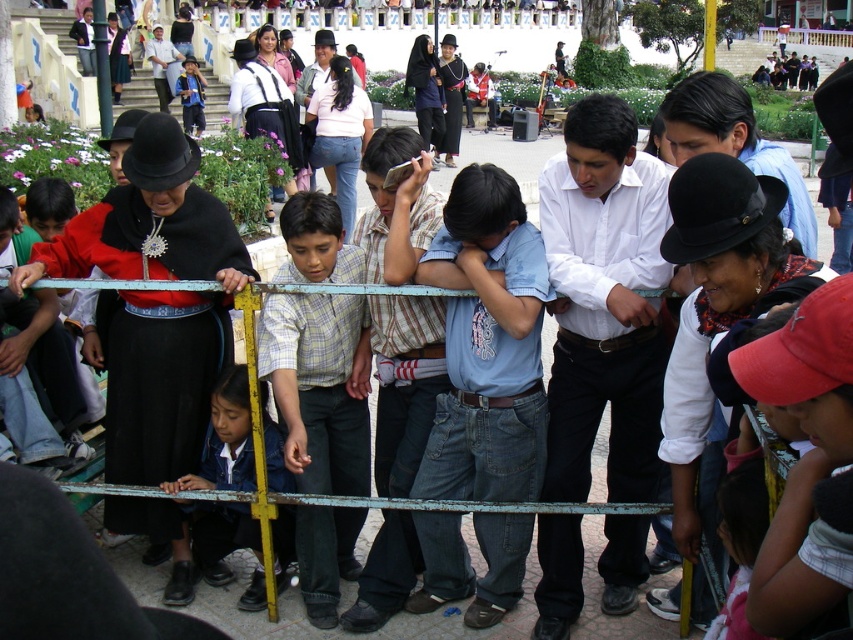
Consider the image. You are a photographer trying to capture a photo of the blue school uniform at lower left without the red cap at lower right blocking it. What should you do?

Move to the side so that the red cap at lower right is no longer in front of the blue school uniform at lower left.

You are a photographer trying to capture a photo of the denim jeans at center and the blue school uniform at lower left. You want to ensure both subjects are in focus. Based on their positions, which one should you focus on first to maximize the chances of both being sharp?

The denim jeans at center is wider than the blue school uniform at lower left, so focusing on the denim jeans at center first would help ensure both are in focus since it is larger and occupies more space in the frame.

You are standing in the plaza and want to move from point [450,324] to point [279,442]. Which direction should you move?

You should move towards the lower right direction because point [279,442] is closer to the viewer than point [450,324].